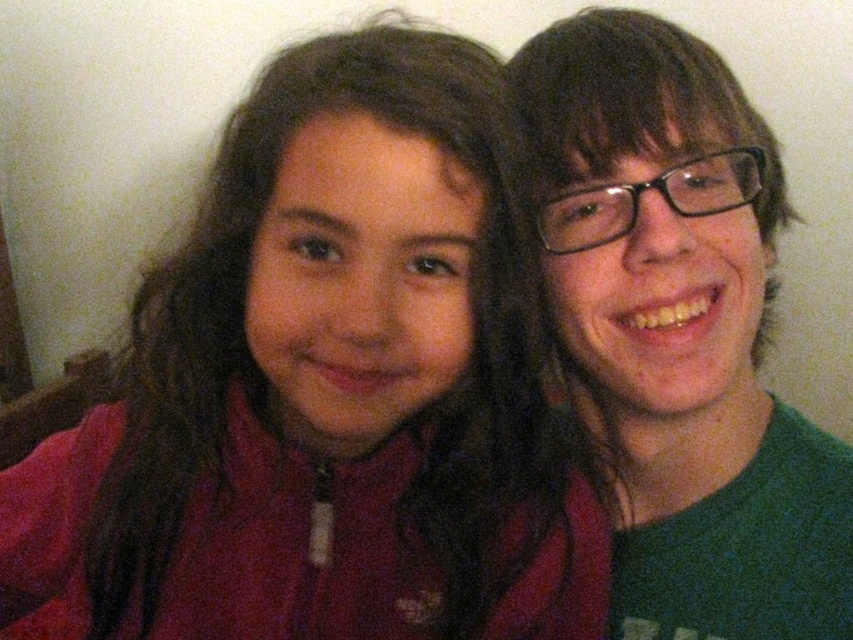
Looking at this image, is matte red jacket at center positioned at the back of green matte shirt at right?

No, it is in front of green matte shirt at right.

Is point (306, 556) more distant than point (647, 417)?

No, it is not.

Locate an element on the screen. Image resolution: width=853 pixels, height=640 pixels. matte red jacket at center is located at coordinates (326, 388).